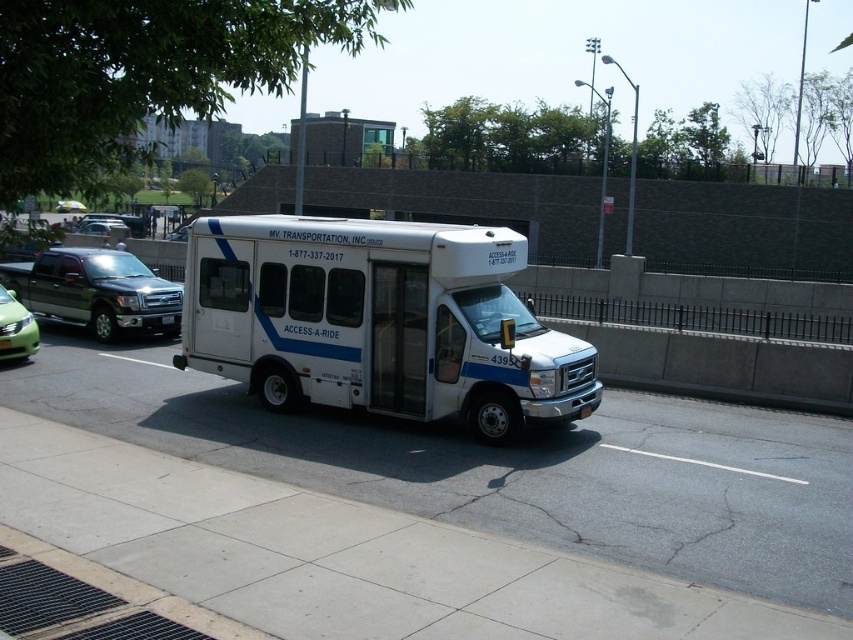
Does metallic gray truck at left appear on the right side of green glossy sedan at left?

Correct, you'll find metallic gray truck at left to the right of green glossy sedan at left.

Describe the element at coordinates (96, 291) in the screenshot. I see `metallic gray truck at left` at that location.

Measure the distance between point (74, 257) and camera.

A distance of 17.03 meters exists between point (74, 257) and camera.

Image resolution: width=853 pixels, height=640 pixels. What are the coordinates of `metallic gray truck at left` in the screenshot? It's located at (96, 291).

Can you confirm if gray concrete pavement at center is positioned to the right of green matte car at center?

Yes, gray concrete pavement at center is to the right of green matte car at center.

Between gray concrete pavement at center and green matte car at center, which one is positioned lower?

gray concrete pavement at center is below.

Is point (505, 497) positioned before point (74, 202)?

Yes, point (505, 497) is in front of point (74, 202).

Locate an element on the screen. gray concrete pavement at center is located at coordinates 509,467.

Is metallic gray truck at left wider than green matte car at center?

No, metallic gray truck at left is not wider than green matte car at center.

Looking at this image, is metallic gray truck at left to the left of green matte car at center from the viewer's perspective?

No, metallic gray truck at left is not to the left of green matte car at center.

Locate an element on the screen. Image resolution: width=853 pixels, height=640 pixels. metallic gray truck at left is located at coordinates (96, 291).